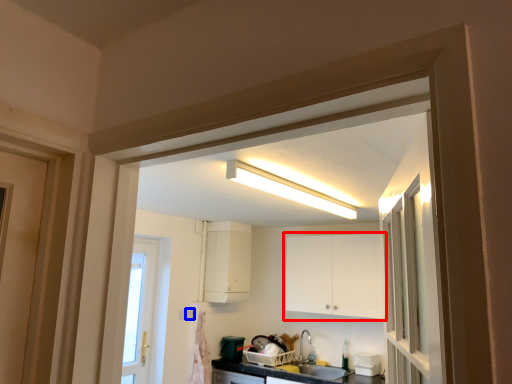
Question: Which object is closer to the camera taking this photo, cabinetry (highlighted by a red box) or electric outlet (highlighted by a blue box)?

Choices:
 (A) cabinetry
 (B) electric outlet

Answer: (A)